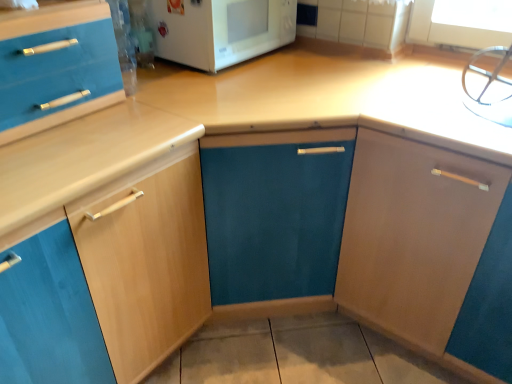
The height and width of the screenshot is (384, 512). What do you see at coordinates (92, 210) in the screenshot? I see `light wood cabinet at left, the 1th cabinetry positioned from the left` at bounding box center [92, 210].

The image size is (512, 384). In order to click on light wood cabinet at left, the 1th cabinetry positioned from the left in this screenshot , I will do `click(92, 210)`.

Could you tell me if white glossy microwave at upper center is turned towards light wood cabinet at left, arranged as the 2th cabinetry when viewed from the right?

No, white glossy microwave at upper center is not facing towards light wood cabinet at left, arranged as the 2th cabinetry when viewed from the right.

From the image's perspective, is white glossy microwave at upper center located above or below light wood cabinet at left, the 1th cabinetry positioned from the left?

white glossy microwave at upper center is above light wood cabinet at left, the 1th cabinetry positioned from the left.

How different are the orientations of white glossy microwave at upper center and light wood cabinet at left, the 1th cabinetry positioned from the left, in degrees?

The angular difference between white glossy microwave at upper center and light wood cabinet at left, the 1th cabinetry positioned from the left, is 0.000476 degrees.

Which of these two, white glossy microwave at upper center or light wood cabinet at left, arranged as the 2th cabinetry when viewed from the right, is smaller?

Smaller between the two is white glossy microwave at upper center.

Would you say light wood cabinet at left, arranged as the 2th cabinetry when viewed from the right, is inside or outside white glossy microwave at upper center?

light wood cabinet at left, arranged as the 2th cabinetry when viewed from the right, lies outside white glossy microwave at upper center.

From the image's perspective, is light wood cabinet at left, arranged as the 2th cabinetry when viewed from the right, beneath white glossy microwave at upper center?

Yes, from the image's perspective, light wood cabinet at left, arranged as the 2th cabinetry when viewed from the right, is beneath white glossy microwave at upper center.

Considering the sizes of objects light wood cabinet at left, arranged as the 2th cabinetry when viewed from the right, and white glossy microwave at upper center in the image provided, who is wider, light wood cabinet at left, arranged as the 2th cabinetry when viewed from the right, or white glossy microwave at upper center?

light wood cabinet at left, arranged as the 2th cabinetry when viewed from the right, is wider.

From a real-world perspective, is matte wood cabinet at right, the second cabinetry viewed from the left, located higher than white glossy microwave at upper center?

Incorrect, from a real-world perspective, matte wood cabinet at right, the second cabinetry viewed from the left, is lower than white glossy microwave at upper center.

Considering the sizes of objects matte wood cabinet at right, which appears as the first cabinetry when viewed from the right, and white glossy microwave at upper center in the image provided, who is thinner, matte wood cabinet at right, which appears as the first cabinetry when viewed from the right, or white glossy microwave at upper center?

With smaller width is white glossy microwave at upper center.

Considering the relative sizes of matte wood cabinet at right, the second cabinetry viewed from the left, and white glossy microwave at upper center in the image provided, is matte wood cabinet at right, the second cabinetry viewed from the left, shorter than white glossy microwave at upper center?

No, matte wood cabinet at right, the second cabinetry viewed from the left, is not shorter than white glossy microwave at upper center.

Is matte wood cabinet at right, the second cabinetry viewed from the left, with white glossy microwave at upper center?

No.

Does point (417, 306) lie in front of point (87, 74)?

No, (417, 306) is behind (87, 74).

In terms of width, does matte wood cabinet at right, which appears as the first cabinetry when viewed from the right, look wider or thinner when compared to light wood cabinet at left, the 1th cabinetry positioned from the left?

In the image, matte wood cabinet at right, which appears as the first cabinetry when viewed from the right, appears to be wider than light wood cabinet at left, the 1th cabinetry positioned from the left.

From the image's perspective, is matte wood cabinet at right, the second cabinetry viewed from the left, above or below light wood cabinet at left, the 1th cabinetry positioned from the left?

Clearly, from the image's perspective, matte wood cabinet at right, the second cabinetry viewed from the left, is above light wood cabinet at left, the 1th cabinetry positioned from the left.

Does white glossy microwave at upper center lie in front of matte wood cabinet at right, which appears as the first cabinetry when viewed from the right?

No, the depth of white glossy microwave at upper center is greater than that of matte wood cabinet at right, which appears as the first cabinetry when viewed from the right.

Locate an element on the screen. home appliance lying behind the matte wood cabinet at right, which appears as the first cabinetry when viewed from the right is located at coordinates pos(220,30).

Which is in front, point (245, 26) or point (396, 194)?

Positioned in front is point (396, 194).

From a real-world perspective, is white glossy microwave at upper center positioned under matte wood cabinet at right, which appears as the first cabinetry when viewed from the right, based on gravity?

No, from a real-world perspective, white glossy microwave at upper center is not beneath matte wood cabinet at right, which appears as the first cabinetry when viewed from the right.

Considering the sizes of objects light wood cabinet at left, the 1th cabinetry positioned from the left, and matte wood cabinet at right, which appears as the first cabinetry when viewed from the right, in the image provided, who is shorter, light wood cabinet at left, the 1th cabinetry positioned from the left, or matte wood cabinet at right, which appears as the first cabinetry when viewed from the right,?

With less height is matte wood cabinet at right, which appears as the first cabinetry when viewed from the right.

Who is more distant, light wood cabinet at left, arranged as the 2th cabinetry when viewed from the right, or matte wood cabinet at right, which appears as the first cabinetry when viewed from the right?

matte wood cabinet at right, which appears as the first cabinetry when viewed from the right, is behind.

Looking at this image, can you confirm if light wood cabinet at left, the 1th cabinetry positioned from the left, is bigger than matte wood cabinet at right, the second cabinetry viewed from the left?

No.

From the image's perspective, is light wood cabinet at left, the 1th cabinetry positioned from the left, on matte wood cabinet at right, the second cabinetry viewed from the left?

No, from the image's perspective, light wood cabinet at left, the 1th cabinetry positioned from the left, is not over matte wood cabinet at right, the second cabinetry viewed from the left.

The height and width of the screenshot is (384, 512). I want to click on home appliance located on the right of light wood cabinet at left, the 1th cabinetry positioned from the left, so click(x=220, y=30).

Find the location of a particular element. The width and height of the screenshot is (512, 384). the 2nd cabinetry below the white glossy microwave at upper center (from the image's perspective) is located at coordinates (92, 210).

Estimate the real-world distances between objects in this image. Which object is further from matte wood cabinet at right, which appears as the first cabinetry when viewed from the right, light wood cabinet at left, the 1th cabinetry positioned from the left, or white glossy microwave at upper center?

white glossy microwave at upper center is further to matte wood cabinet at right, which appears as the first cabinetry when viewed from the right.

Which object lies nearer to the anchor point light wood cabinet at left, arranged as the 2th cabinetry when viewed from the right, white glossy microwave at upper center or matte wood cabinet at right, which appears as the first cabinetry when viewed from the right?

white glossy microwave at upper center is closer to light wood cabinet at left, arranged as the 2th cabinetry when viewed from the right.

Based on their spatial positions, is matte wood cabinet at right, the second cabinetry viewed from the left, or light wood cabinet at left, arranged as the 2th cabinetry when viewed from the right, closer to white glossy microwave at upper center?

The object closer to white glossy microwave at upper center is light wood cabinet at left, arranged as the 2th cabinetry when viewed from the right.

Estimate the real-world distances between objects in this image. Which object is closer to light wood cabinet at left, the 1th cabinetry positioned from the left, matte wood cabinet at right, which appears as the first cabinetry when viewed from the right, or white glossy microwave at upper center?

Based on the image, white glossy microwave at upper center appears to be nearer to light wood cabinet at left, the 1th cabinetry positioned from the left.

When comparing their distances from white glossy microwave at upper center, does light wood cabinet at left, the 1th cabinetry positioned from the left, or matte wood cabinet at right, which appears as the first cabinetry when viewed from the right, seem further?

The object further to white glossy microwave at upper center is matte wood cabinet at right, which appears as the first cabinetry when viewed from the right.

When comparing their distances from matte wood cabinet at right, which appears as the first cabinetry when viewed from the right, does white glossy microwave at upper center or light wood cabinet at left, the 1th cabinetry positioned from the left, seem further?

white glossy microwave at upper center is further to matte wood cabinet at right, which appears as the first cabinetry when viewed from the right.

This screenshot has width=512, height=384. Identify the location of home appliance between light wood cabinet at left, the 1th cabinetry positioned from the left, and matte wood cabinet at right, which appears as the first cabinetry when viewed from the right, in the horizontal direction. (220, 30).